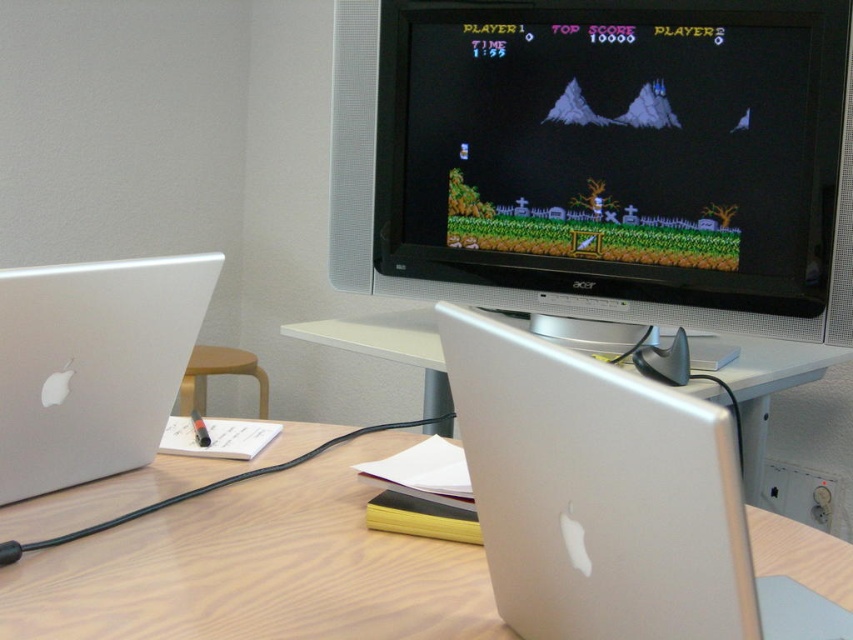
Based on the photo, you are a drone operator trying to navigate between two points in the scene. The points are labeled as point (26,396) and point (796,371). Given that your drone can only fly at a safe altitude above the desk, which point should you target first to ensure the shortest flight path?

Point (26,396) is closer to the viewer than point (796,371). Therefore, the drone should target point (26,396) first as it is nearer, resulting in a shorter flight path.

From the picture: You are a delivery person who needs to place a new 15 inch laptop between the two existing silver metallic laptop at center. Can you fit it without moving the existing laptops?

The two silver metallic laptop at center are 14.71 inches apart. Since the new laptop is 15 inches wide, there isn t enough space to fit it between them without moving the existing laptops.

You are a delivery person who needs to place a package on the desk. The package requires a flat surface area of at least 10x10 inches. Can you place it between the silver metallic laptop at center and the CRT monitor in the background?

The silver metallic laptop at center is located at point (x=608, y=499), but the exact distance between it and the CRT monitor in the background isn